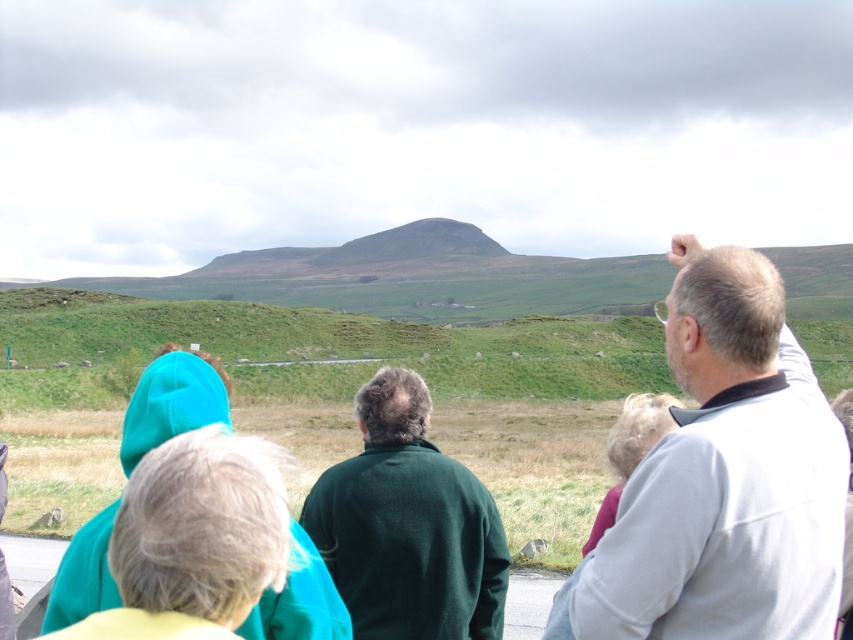
Question: Is gray fleece jacket at upper right below dark green sweater at center?

Choices:
 (A) no
 (B) yes

Answer: (A)

Question: Is gray fleece jacket at upper right to the right of dark green sweater at center from the viewer's perspective?

Choices:
 (A) no
 (B) yes

Answer: (B)

Question: Is gray fleece jacket at upper right to the left of dark green sweater at center from the viewer's perspective?

Choices:
 (A) yes
 (B) no

Answer: (B)

Question: Which point appears farthest from the camera in this image?

Choices:
 (A) (397, 570)
 (B) (724, 566)

Answer: (A)